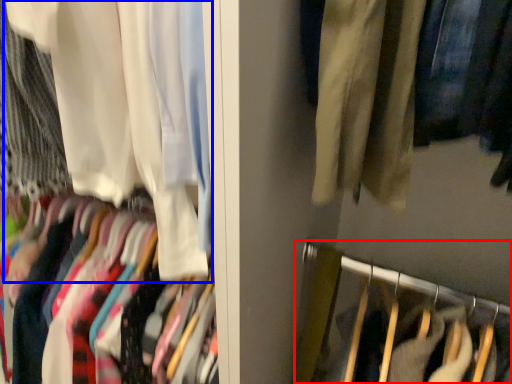
Question: Which object appears closest to the camera in this image, closet (highlighted by a red box) or curtain (highlighted by a blue box)?

Choices:
 (A) closet
 (B) curtain

Answer: (B)